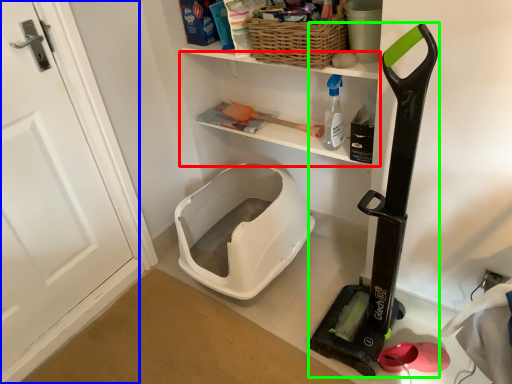
Question: Based on their relative distances, which object is farther from shelf (highlighted by a red box)? Choose from door (highlighted by a blue box) and appliance (highlighted by a green box).

Choices:
 (A) door
 (B) appliance

Answer: (A)